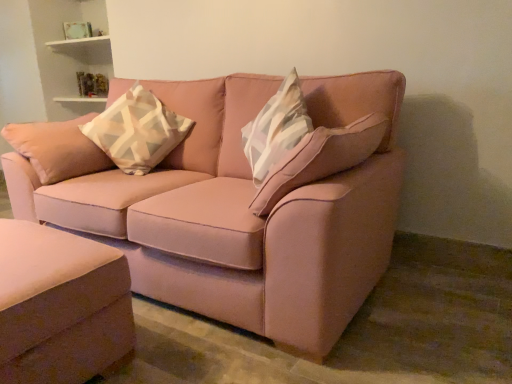
What do you see at coordinates (137, 131) in the screenshot? I see `white and gray geometric-patterned pillow at upper left` at bounding box center [137, 131].

What do you see at coordinates (248, 208) in the screenshot?
I see `matte pink fabric couch at center, which is counted as the 1th studio couch, starting from the top` at bounding box center [248, 208].

What are the coordinates of `satin pink ottoman at lower left, positioned as the 2th studio couch in top-to-bottom order` in the screenshot? It's located at (60, 305).

What do you see at coordinates (60, 305) in the screenshot? I see `satin pink ottoman at lower left, positioned as the 2th studio couch in top-to-bottom order` at bounding box center [60, 305].

Where is `white and gray geometric-patterned pillow at upper left`? The width and height of the screenshot is (512, 384). white and gray geometric-patterned pillow at upper left is located at coordinates (137, 131).

Is the position of matte pink fabric couch at center, which is counted as the 1th studio couch, starting from the top, more distant than that of satin pink ottoman at lower left, positioned as the 2th studio couch in top-to-bottom order?

Yes, matte pink fabric couch at center, which is counted as the 1th studio couch, starting from the top, is further from the camera.

Is matte pink fabric couch at center, which is counted as the 2th studio couch, starting from the bottom, at the right side of satin pink ottoman at lower left, positioned as the 2th studio couch in top-to-bottom order?

Yes.

From a real-world perspective, is matte pink fabric couch at center, which is counted as the 2th studio couch, starting from the bottom, beneath satin pink ottoman at lower left, which ranks as the 1th studio couch in bottom-to-top order?

No.

Between matte pink fabric couch at center, which is counted as the 1th studio couch, starting from the top, and satin pink ottoman at lower left, positioned as the 2th studio couch in top-to-bottom order, which one has smaller width?

With smaller width is satin pink ottoman at lower left, positioned as the 2th studio couch in top-to-bottom order.

Is matte pink fabric couch at center, which is counted as the 1th studio couch, starting from the top, oriented away from white and gray geometric-patterned pillow at upper left?

Yes.

Considering the relative sizes of matte pink fabric couch at center, which is counted as the 2th studio couch, starting from the bottom, and white and gray geometric-patterned pillow at upper left in the image provided, is matte pink fabric couch at center, which is counted as the 2th studio couch, starting from the bottom, wider than white and gray geometric-patterned pillow at upper left?

Indeed, matte pink fabric couch at center, which is counted as the 2th studio couch, starting from the bottom, has a greater width compared to white and gray geometric-patterned pillow at upper left.

How far apart are matte pink fabric couch at center, which is counted as the 1th studio couch, starting from the top, and white and gray geometric-patterned pillow at upper left?

The distance of matte pink fabric couch at center, which is counted as the 1th studio couch, starting from the top, from white and gray geometric-patterned pillow at upper left is 48.49 centimeters.

Is the surface of matte pink fabric couch at center, which is counted as the 1th studio couch, starting from the top, in direct contact with white and gray geometric-patterned pillow at upper left?

No, matte pink fabric couch at center, which is counted as the 1th studio couch, starting from the top, is not touching white and gray geometric-patterned pillow at upper left.

From the picture: Which object is more forward, satin pink ottoman at lower left, positioned as the 2th studio couch in top-to-bottom order, or matte pink fabric couch at center, which is counted as the 1th studio couch, starting from the top?

satin pink ottoman at lower left, positioned as the 2th studio couch in top-to-bottom order, is in front.

Is satin pink ottoman at lower left, positioned as the 2th studio couch in top-to-bottom order, at the left side of matte pink fabric couch at center, which is counted as the 2th studio couch, starting from the bottom?

Indeed, satin pink ottoman at lower left, positioned as the 2th studio couch in top-to-bottom order, is positioned on the left side of matte pink fabric couch at center, which is counted as the 2th studio couch, starting from the bottom.

Is point (42, 265) positioned before point (278, 196)?

Yes.

From the image's perspective, is satin pink ottoman at lower left, which ranks as the 1th studio couch in bottom-to-top order, on matte pink fabric couch at center, which is counted as the 2th studio couch, starting from the bottom?

Incorrect, from the image's perspective, satin pink ottoman at lower left, which ranks as the 1th studio couch in bottom-to-top order, is lower than matte pink fabric couch at center, which is counted as the 2th studio couch, starting from the bottom.

Which object is closer to the camera, white and gray geometric-patterned pillow at upper left or matte pink fabric couch at center, which is counted as the 1th studio couch, starting from the top?

matte pink fabric couch at center, which is counted as the 1th studio couch, starting from the top, is in front.

Is matte pink fabric couch at center, which is counted as the 2th studio couch, starting from the bottom, at the back of white and gray geometric-patterned pillow at upper left?

Yes, matte pink fabric couch at center, which is counted as the 2th studio couch, starting from the bottom, is at the back of white and gray geometric-patterned pillow at upper left.

From the picture: Which of these two, white and gray geometric-patterned pillow at upper left or satin pink ottoman at lower left, positioned as the 2th studio couch in top-to-bottom order, stands shorter?

satin pink ottoman at lower left, positioned as the 2th studio couch in top-to-bottom order.

Based on the photo, from the image's perspective, relative to satin pink ottoman at lower left, which ranks as the 1th studio couch in bottom-to-top order, is white and gray geometric-patterned pillow at upper left above or below?

white and gray geometric-patterned pillow at upper left is situated higher than satin pink ottoman at lower left, which ranks as the 1th studio couch in bottom-to-top order, in the image.

Which object is closer to the camera taking this photo, white and gray geometric-patterned pillow at upper left or satin pink ottoman at lower left, positioned as the 2th studio couch in top-to-bottom order?

satin pink ottoman at lower left, positioned as the 2th studio couch in top-to-bottom order, is in front.

Does satin pink ottoman at lower left, positioned as the 2th studio couch in top-to-bottom order, have a greater height compared to white and gray geometric-patterned pillow at upper left?

In fact, satin pink ottoman at lower left, positioned as the 2th studio couch in top-to-bottom order, may be shorter than white and gray geometric-patterned pillow at upper left.

Is white and gray geometric-patterned pillow at upper left located within satin pink ottoman at lower left, which ranks as the 1th studio couch in bottom-to-top order?

No.

Does point (60, 275) lie behind point (101, 122)?

No.

Is satin pink ottoman at lower left, positioned as the 2th studio couch in top-to-bottom order, far away from white and gray geometric-patterned pillow at upper left?

No, satin pink ottoman at lower left, positioned as the 2th studio couch in top-to-bottom order, is in close proximity to white and gray geometric-patterned pillow at upper left.

At what (x,y) coordinates should I click in order to perform the action: click on studio couch behind the satin pink ottoman at lower left, which ranks as the 1th studio couch in bottom-to-top order. Please return your answer as a coordinate pair (x, y). This screenshot has width=512, height=384. Looking at the image, I should click on (248, 208).

The image size is (512, 384). What are the coordinates of `studio couch on the right of white and gray geometric-patterned pillow at upper left` in the screenshot? It's located at (248, 208).

Which object lies nearer to the anchor point white and gray geometric-patterned pillow at upper left, matte pink fabric couch at center, which is counted as the 2th studio couch, starting from the bottom, or satin pink ottoman at lower left, which ranks as the 1th studio couch in bottom-to-top order?

The object closer to white and gray geometric-patterned pillow at upper left is matte pink fabric couch at center, which is counted as the 2th studio couch, starting from the bottom.

When comparing their distances from matte pink fabric couch at center, which is counted as the 2th studio couch, starting from the bottom, does white and gray geometric-patterned pillow at upper left or satin pink ottoman at lower left, which ranks as the 1th studio couch in bottom-to-top order, seem further?

Among the two, satin pink ottoman at lower left, which ranks as the 1th studio couch in bottom-to-top order, is located further to matte pink fabric couch at center, which is counted as the 2th studio couch, starting from the bottom.

Estimate the real-world distances between objects in this image. Which object is further from satin pink ottoman at lower left, which ranks as the 1th studio couch in bottom-to-top order, white and gray geometric-patterned pillow at upper left or matte pink fabric couch at center, which is counted as the 2th studio couch, starting from the bottom?

white and gray geometric-patterned pillow at upper left is further to satin pink ottoman at lower left, which ranks as the 1th studio couch in bottom-to-top order.

Considering their positions, is matte pink fabric couch at center, which is counted as the 1th studio couch, starting from the top, positioned closer to satin pink ottoman at lower left, positioned as the 2th studio couch in top-to-bottom order, than white and gray geometric-patterned pillow at upper left?

matte pink fabric couch at center, which is counted as the 1th studio couch, starting from the top, is positioned closer to the anchor satin pink ottoman at lower left, positioned as the 2th studio couch in top-to-bottom order.

Estimate the real-world distances between objects in this image. Which object is further from matte pink fabric couch at center, which is counted as the 2th studio couch, starting from the bottom, satin pink ottoman at lower left, which ranks as the 1th studio couch in bottom-to-top order, or white and gray geometric-patterned pillow at upper left?

satin pink ottoman at lower left, which ranks as the 1th studio couch in bottom-to-top order, is positioned further to the anchor matte pink fabric couch at center, which is counted as the 2th studio couch, starting from the bottom.

When comparing their distances from white and gray geometric-patterned pillow at upper left, does satin pink ottoman at lower left, positioned as the 2th studio couch in top-to-bottom order, or matte pink fabric couch at center, which is counted as the 2th studio couch, starting from the bottom, seem further?

satin pink ottoman at lower left, positioned as the 2th studio couch in top-to-bottom order, lies further to white and gray geometric-patterned pillow at upper left than the other object.

Where is `studio couch between satin pink ottoman at lower left, which ranks as the 1th studio couch in bottom-to-top order, and white and gray geometric-patterned pillow at upper left, along the z-axis`? studio couch between satin pink ottoman at lower left, which ranks as the 1th studio couch in bottom-to-top order, and white and gray geometric-patterned pillow at upper left, along the z-axis is located at coordinates (248, 208).